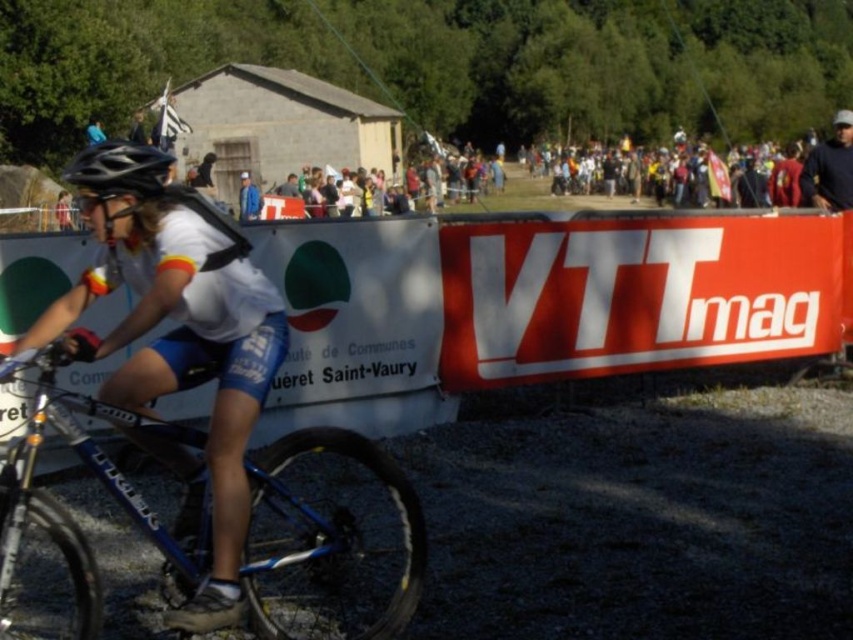
Question: Estimate the real-world distances between objects in this image. Which object is closer to the dark blue shirt at upper right?

Choices:
 (A) blue metallic bicycle at center
 (B) black matte helmet at center

Answer: (A)

Question: Which point is closer to the camera?

Choices:
 (A) (134, 177)
 (B) (402, 536)

Answer: (A)

Question: Does matte black helmet at upper left appear on the right side of dark blue shirt at upper right?

Choices:
 (A) no
 (B) yes

Answer: (A)

Question: From the image, what is the correct spatial relationship of blue metallic bicycle at center in relation to black matte helmet at center?

Choices:
 (A) left
 (B) right

Answer: (B)

Question: Which point is closer to the camera?

Choices:
 (A) (107, 177)
 (B) (839, 150)

Answer: (A)

Question: Observing the image, what is the correct spatial positioning of blue metallic bicycle at center in reference to dark blue shirt at upper right?

Choices:
 (A) left
 (B) right

Answer: (A)